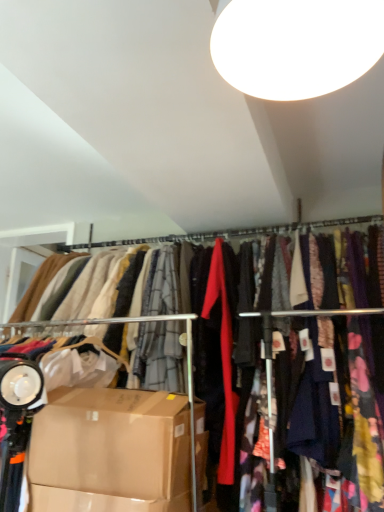
Question: Looking at their shapes, would you say brown cardboard box at lower left is wider or thinner than silky fabric clothesline at center?

Choices:
 (A) wide
 (B) thin

Answer: (A)

Question: Is brown cardboard box at lower left to the left or to the right of silky fabric clothesline at center in the image?

Choices:
 (A) left
 (B) right

Answer: (A)

Question: Which object is the farthest from the brown cardboard box at lower left?

Choices:
 (A) silky fabric clothesline at center
 (B) white glossy light fixture at upper center

Answer: (B)

Question: Which of these objects is positioned closest to the silky fabric clothesline at center?

Choices:
 (A) brown cardboard box at lower left
 (B) white glossy light fixture at upper center

Answer: (A)